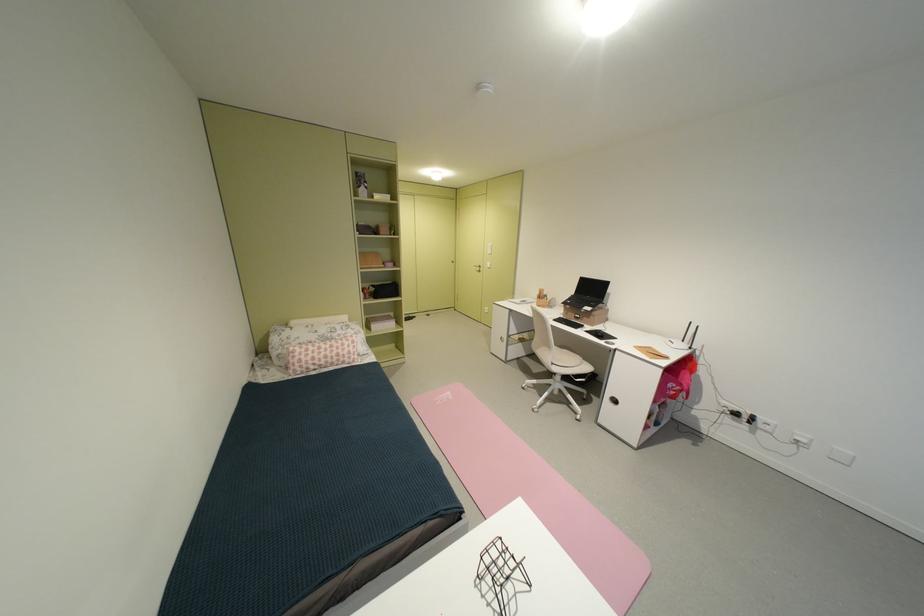
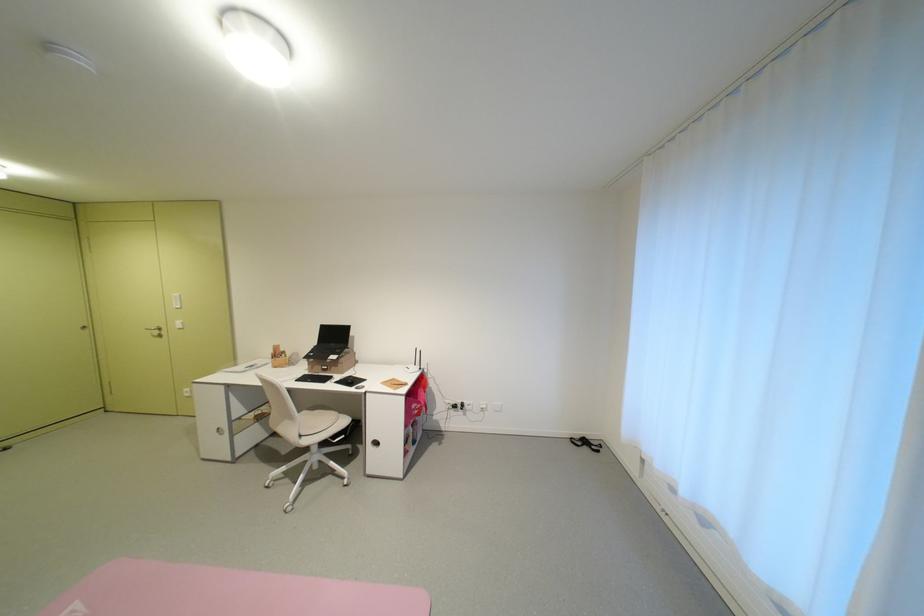
The point at (598,318) is marked in the first image. Where is the corresponding point in the second image?

(346, 368)